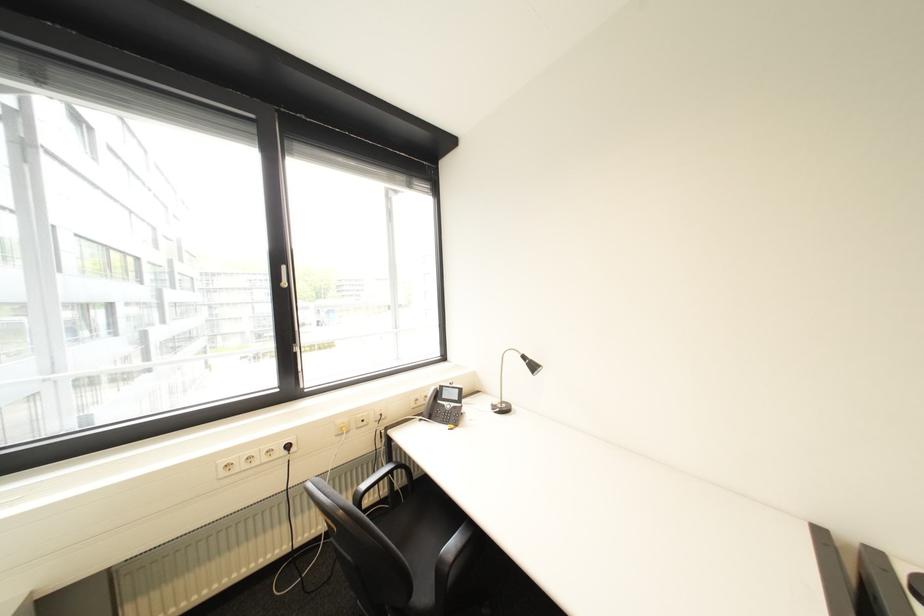
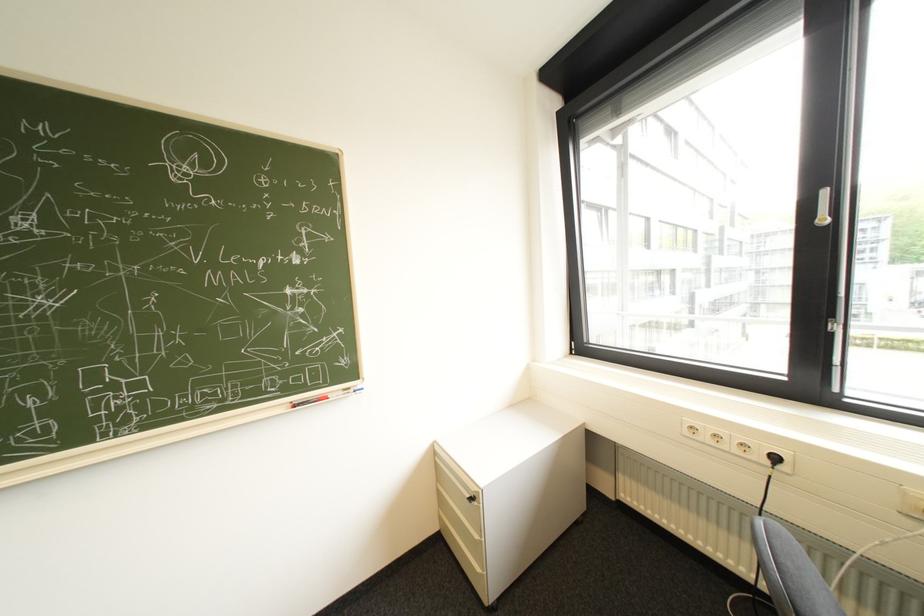
Locate, in the second image, the point that corresponds to (270,464) in the first image.

(737, 450)